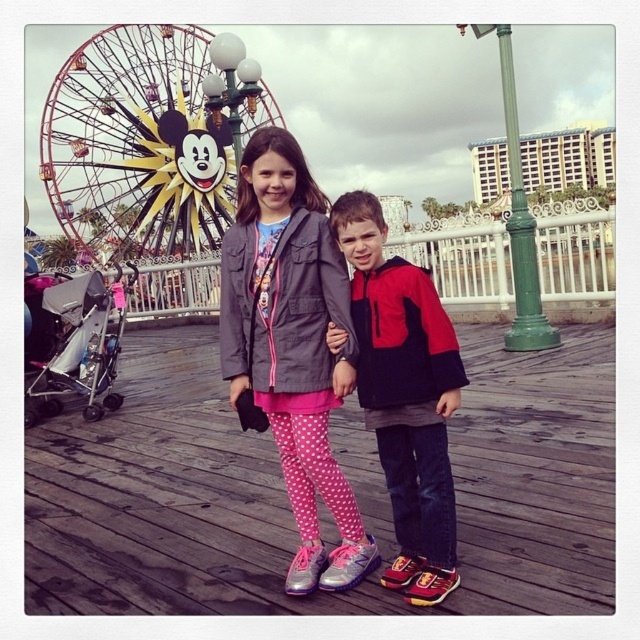
You are standing at the point closer to the Ferris wheel in the image. There are two points marked in the scene, one at coordinates point (93, 104) and the other at point (422, 525). Which point should you move towards to get closer to the Ferris wheel?

Point (93, 104) is behind point (422, 525), so you should move towards point (93, 104) to get closer to the Ferris wheel since it is positioned behind and thus nearer to the Ferris wheel in the background.

You are a photographer taking a picture of the metallic ferris wheel at upper left and the pink fabric pants at center. Based on their positions, which object is closer to the right edge of the photo?

The pink fabric pants at center are closer to the right edge of the photo because they are positioned to the right of the metallic ferris wheel at upper left.

You are a photographer taking a picture of the pink fabric pants at center and the metallic ferris wheel at upper left. Where should you position the camera to ensure both objects are in frame?

Position the camera so that the pink fabric pants at center are directly below the metallic ferris wheel at upper left, ensuring both are visible within the frame.